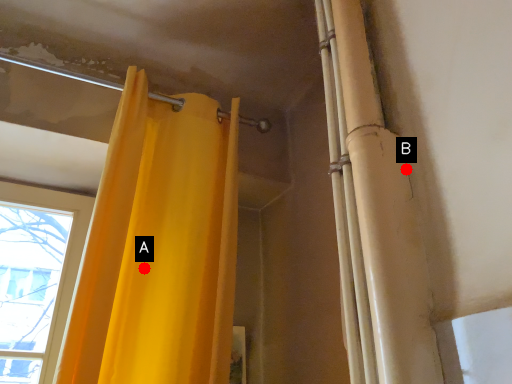
Question: Two points are circled on the image, labeled by A and B beside each circle. Among these points, which one is farthest from the camera?

Choices:
 (A) A is further
 (B) B is further

Answer: (A)